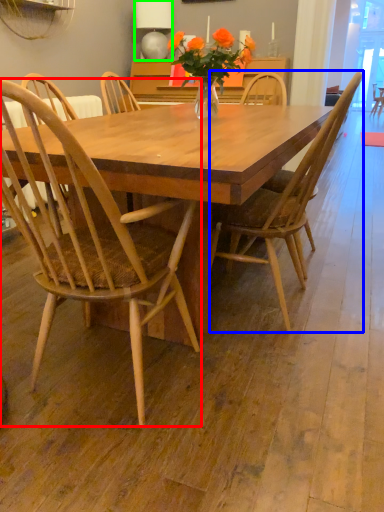
Question: Based on their relative distances, which object is farther from chair (highlighted by a red box)? Choose from chair (highlighted by a blue box) and lamp (highlighted by a green box).

Choices:
 (A) chair
 (B) lamp

Answer: (B)